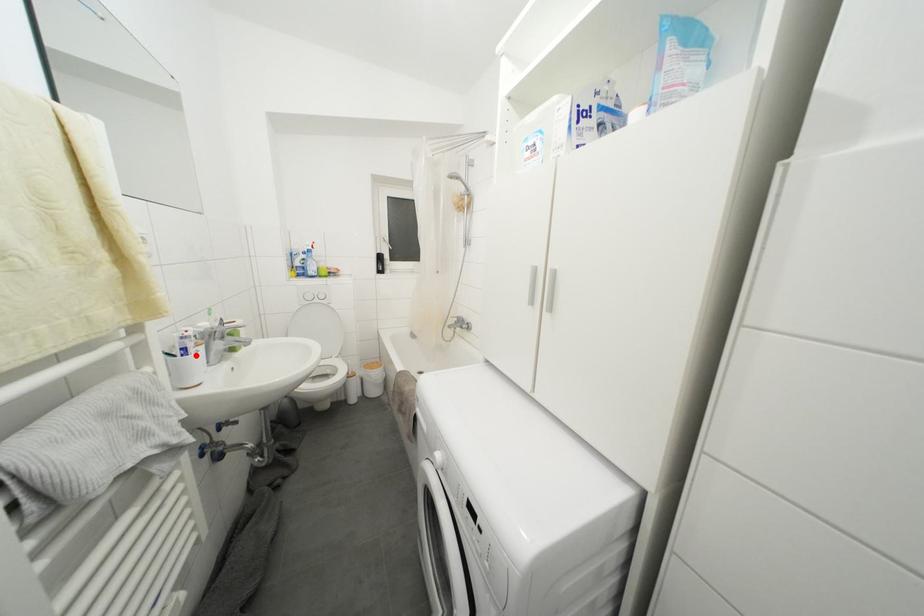
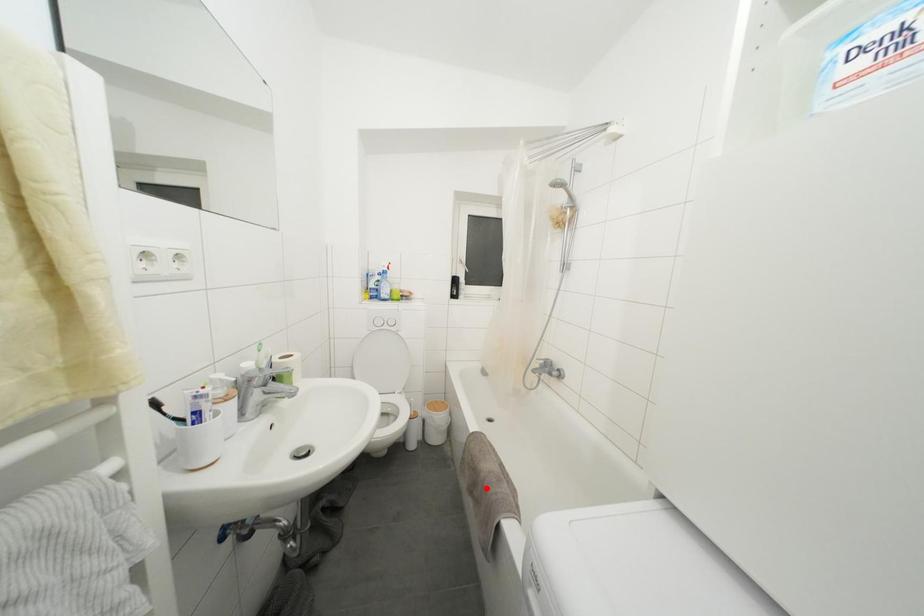
I am providing you with two images of the same scene from different viewpoints. A red point is marked on the first image and another point is marked on the second image. Do the highlighted points in image1 and image2 indicate the same real-world spot?

No